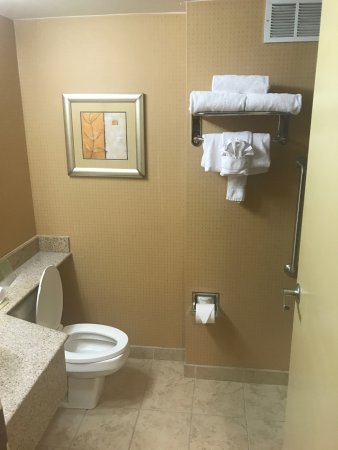
Find the location of a particular element. The width and height of the screenshot is (338, 450). toilet seat is located at coordinates (75, 356), (90, 325), (122, 344).